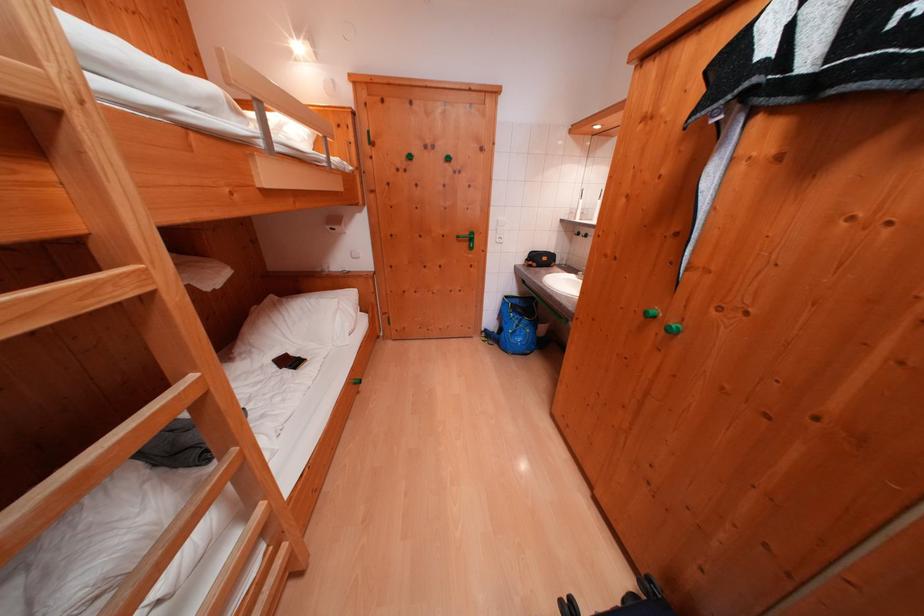
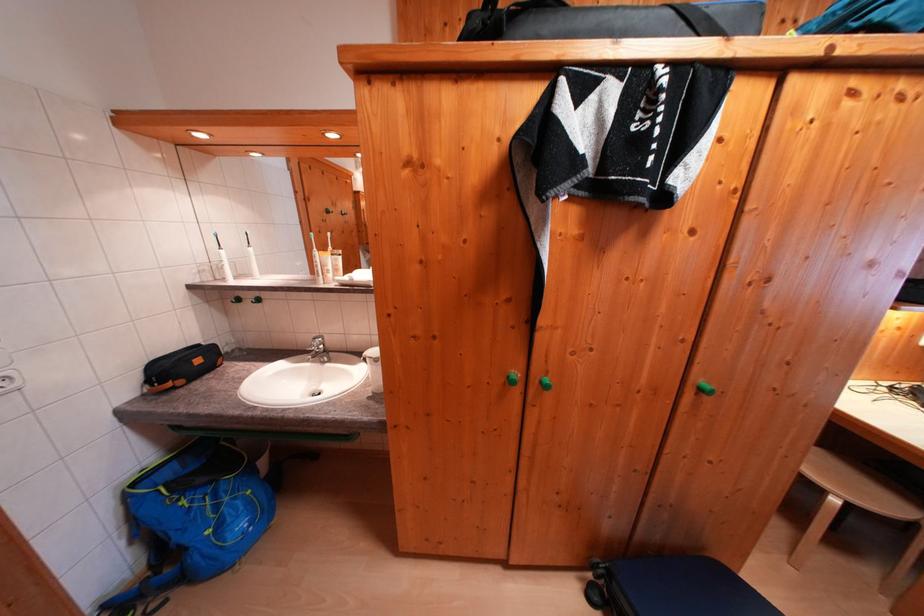
Find the pixel in the second image that matches (515,301) in the first image.

(142, 488)